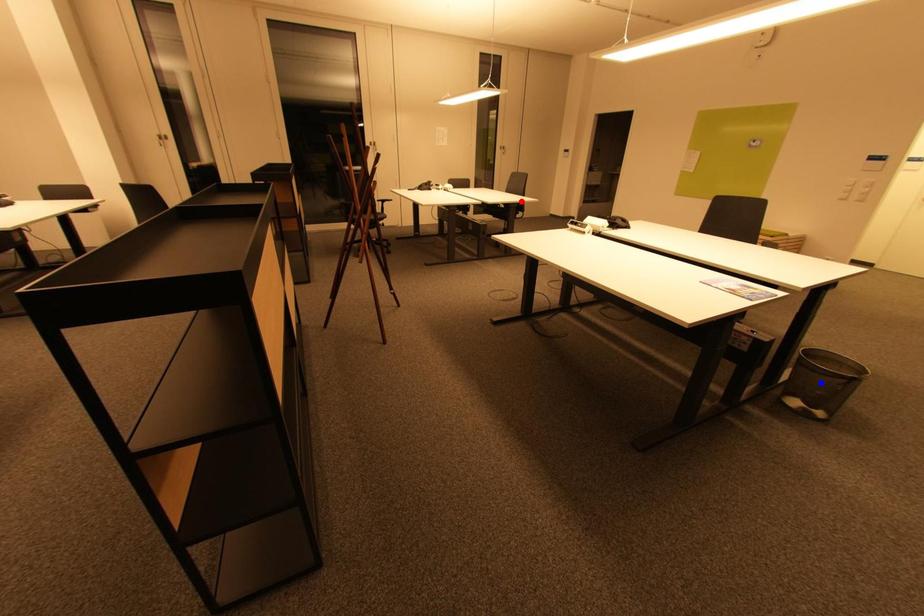
Question: Two points are marked on the image. Which point is closer to the camera?

Choices:
 (A) Blue point is closer.
 (B) Red point is closer.

Answer: (A)